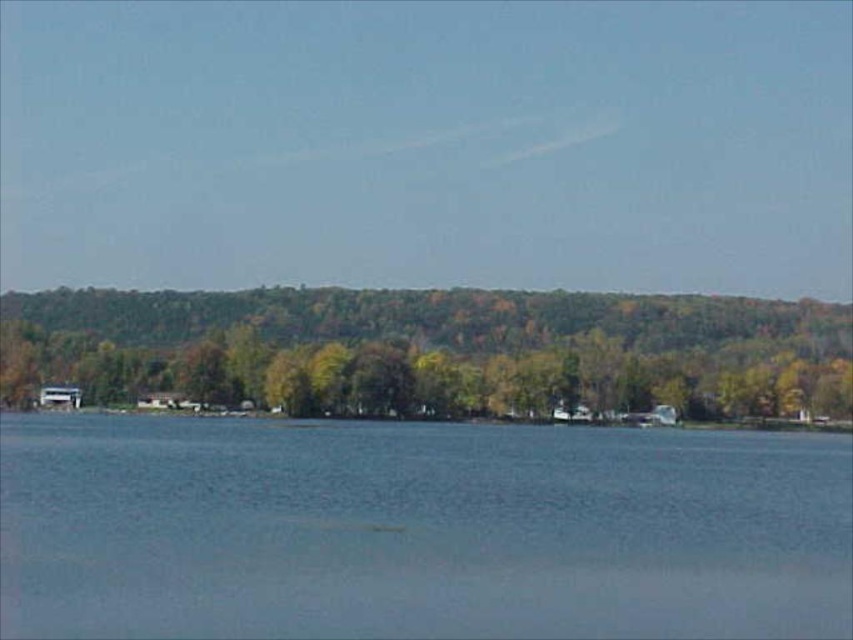
You are standing at the lakeside and want to take a photo that includes both the blue water at center and the green leafy trees at center. Which object should you position closer to the edge of the frame to ensure both are fully visible?

Since the blue water at center has a lesser width compared to the green leafy trees at center, you should position the blue water at center closer to the edge of the frame to ensure both objects are fully visible.

Where is the blue water at center located in the image?

The blue water at center is located at point 0.828 on the horizontal axis and 0.491 on the vertical axis.

You are standing on the lakeside path and see the blue water at center and the green leafy trees at center. Which object is located lower in the image?

The blue water at center is located lower in the image than the green leafy trees at center because the description states that the blue water at center is below green leafy trees at center.